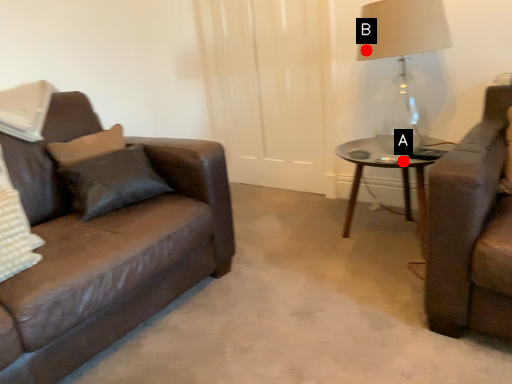
Question: Two points are circled on the image, labeled by A and B beside each circle. Among these points, which one is nearest to the camera?

Choices:
 (A) A is closer
 (B) B is closer

Answer: (A)